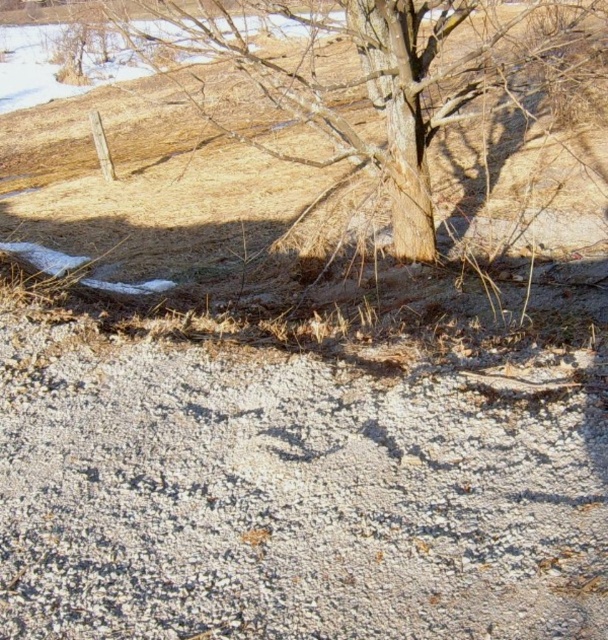
Is point (606, 612) more distant than point (426, 209)?

No, (606, 612) is closer to viewer.

Is point (361, 481) closer to viewer compared to point (451, 120)?

That is True.

Between point (261, 461) and point (468, 116), which one is positioned behind?

Positioned behind is point (468, 116).

This screenshot has height=640, width=608. Find the location of `gray gravelly dirt track at lower center`. gray gravelly dirt track at lower center is located at coordinates (288, 493).